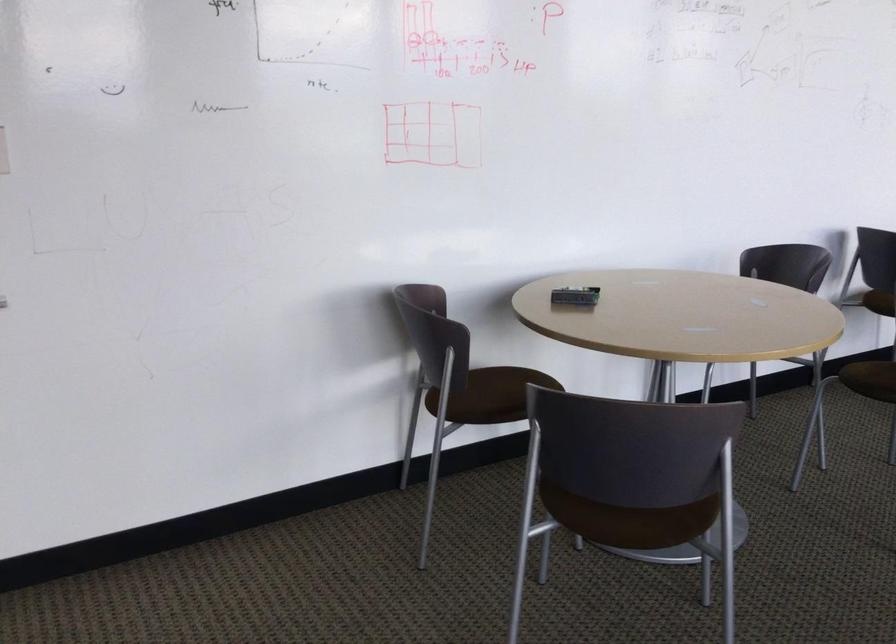
The height and width of the screenshot is (644, 896). Describe the element at coordinates (575, 296) in the screenshot. I see `a whiteboard eraser` at that location.